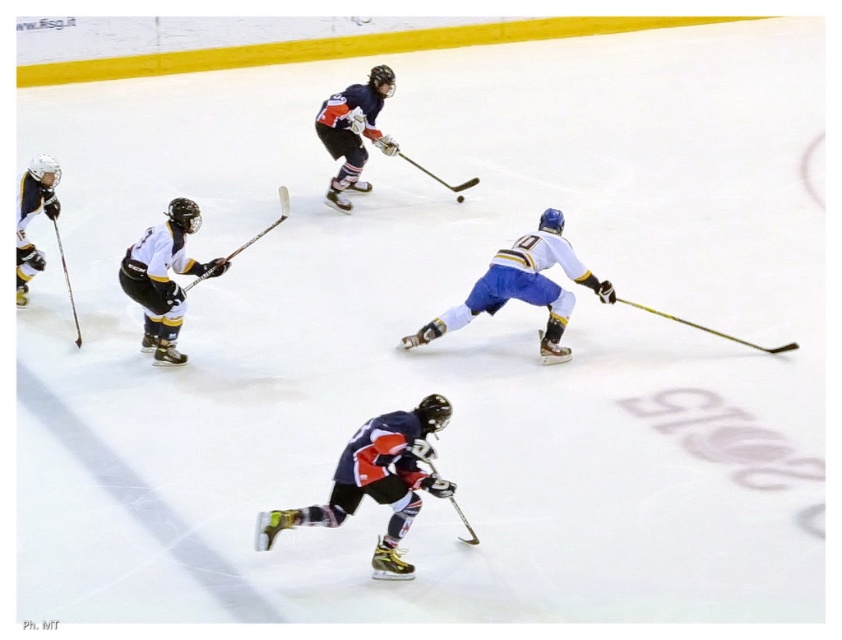
Does yellow matte hockey stick at lower right have a greater height compared to shiny black hockey stick at left?

Incorrect, yellow matte hockey stick at lower right's height is not larger of shiny black hockey stick at left's.

Is yellow matte hockey stick at lower right bigger than shiny black hockey stick at left?

Actually, yellow matte hockey stick at lower right might be smaller than shiny black hockey stick at left.

Which is in front, point (643, 308) or point (68, 282)?

Positioned in front is point (643, 308).

The height and width of the screenshot is (640, 842). Find the location of `yellow matte hockey stick at lower right`. yellow matte hockey stick at lower right is located at coordinates (712, 330).

Is point (382, 141) positioned behind point (62, 259)?

Yes, point (382, 141) is farther from viewer.

Where is `shiny black hockey stick at center`? This screenshot has width=842, height=640. shiny black hockey stick at center is located at coordinates (429, 170).

Which is behind, point (734, 340) or point (377, 141)?

The point (377, 141) is behind.

Between point (669, 316) and point (379, 147), which one is positioned in front?

Positioned in front is point (669, 316).

Where is `yellow matte hockey stick at lower right`? This screenshot has width=842, height=640. yellow matte hockey stick at lower right is located at coordinates (712, 330).